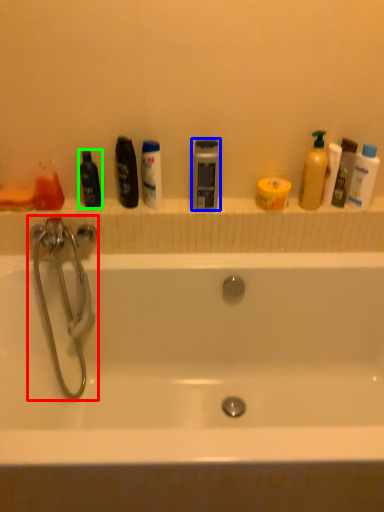
Question: Based on their relative distances, which object is farther from tap (highlighted by a red box)? Choose from mouthwash (highlighted by a blue box) and mouthwash (highlighted by a green box).

Choices:
 (A) mouthwash
 (B) mouthwash

Answer: (A)